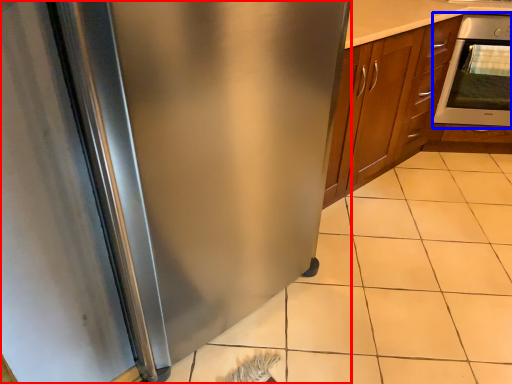
Question: Which object appears farthest to the camera in this image, refrigerator (highlighted by a red box) or oven (highlighted by a blue box)?

Choices:
 (A) refrigerator
 (B) oven

Answer: (B)